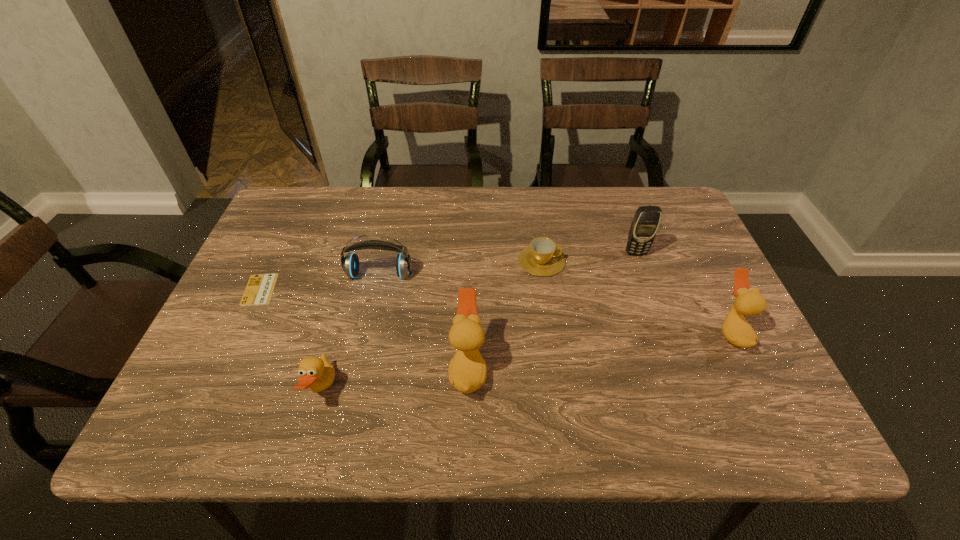
Locate an element on the screen. The height and width of the screenshot is (540, 960). the fifth object from left to right is located at coordinates (542, 258).

Locate an element on the screen. Image resolution: width=960 pixels, height=540 pixels. cup is located at coordinates (542, 258).

Find the location of a particular element. vacant space located on the beak of the third shortest object is located at coordinates (359, 389).

Locate an element on the screen. Image resolution: width=960 pixels, height=540 pixels. blank space located on the beak of the fourth object from left to right is located at coordinates (297, 369).

You are a GUI agent. You are given a task and a screenshot of the screen. Output one action in this format:
    pyautogui.click(x=<x>, y=<y>)
    Task: Click on the blank area located on the beak of the fourth object from left to right
    The image size is (960, 540).
    Given the screenshot: What is the action you would take?
    pyautogui.click(x=329, y=369)

The image size is (960, 540). Find the location of `free space located 0.350m on the beak of the fourth object from left to right`. free space located 0.350m on the beak of the fourth object from left to right is located at coordinates (287, 369).

The image size is (960, 540). What are the coordinates of `vacant position located 0.220m on the beak of the rightmost duck` in the screenshot? It's located at (621, 332).

Where is `vacant space located on the beak of the rightmost duck`? The width and height of the screenshot is (960, 540). vacant space located on the beak of the rightmost duck is located at coordinates (678, 332).

I want to click on free space located 0.210m on the beak of the rightmost duck, so click(626, 332).

Find the location of a particular element. Image resolution: width=960 pixels, height=540 pixels. vacant space located 0.290m on the back of the identity card is located at coordinates (299, 206).